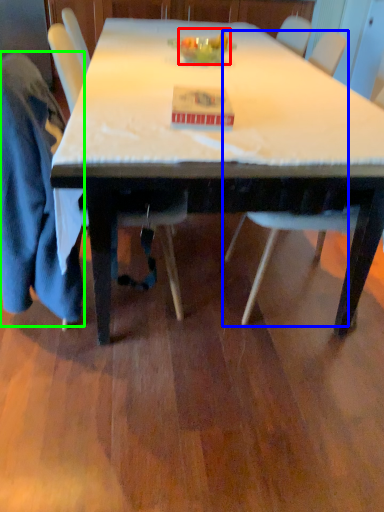
Question: Considering the real-world distances, which object is farthest from food (highlighted by a red box)? chair (highlighted by a blue box) or robe (highlighted by a green box)?

Choices:
 (A) chair
 (B) robe

Answer: (B)